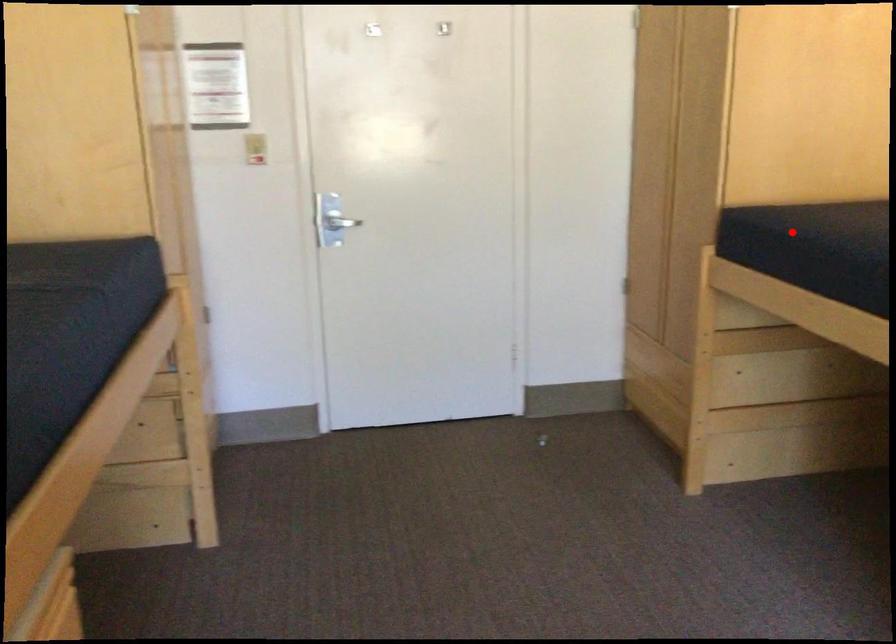
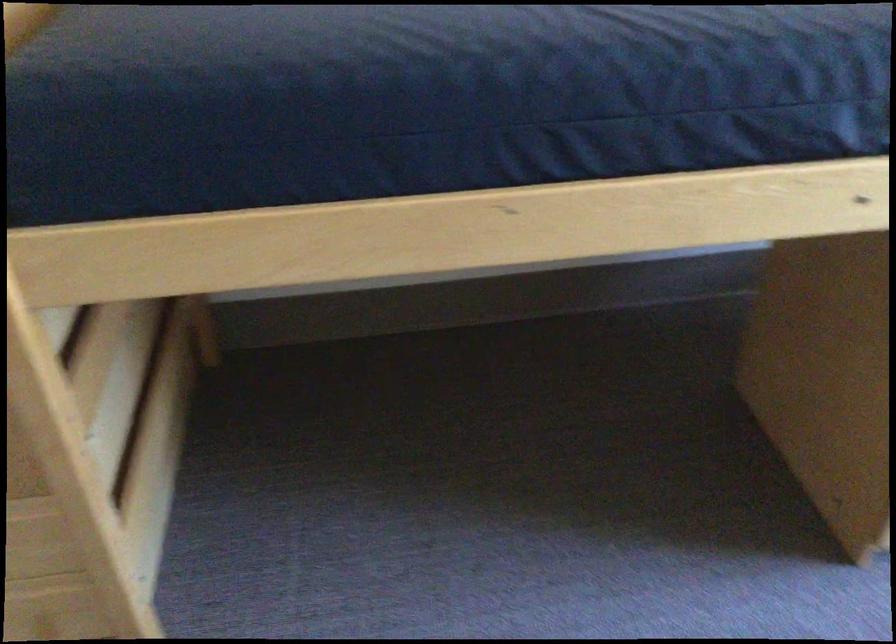
Locate, in the second image, the point that corresponds to the highlighted location in the first image.

(280, 106)